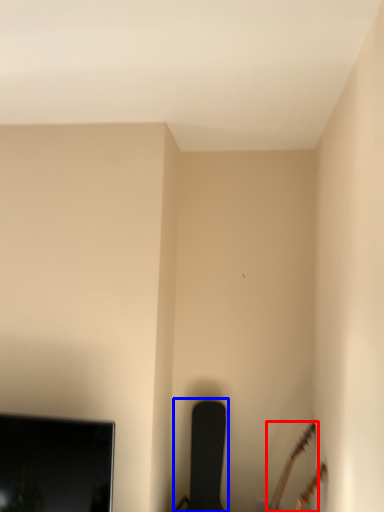
Question: Which point is further to the camera, guitar (highlighted by a red box) or chair (highlighted by a blue box)?

Choices:
 (A) guitar
 (B) chair

Answer: (B)